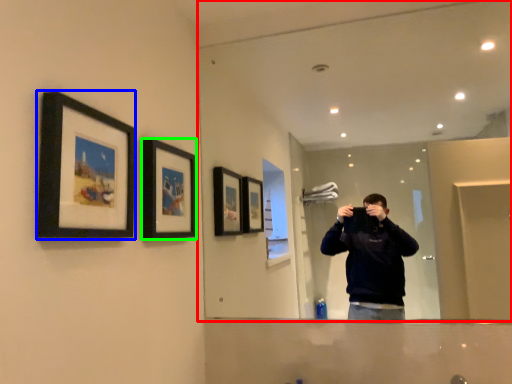
Question: Which object is the closest to the mirror (highlighted by a red box)? Choose among these: picture frame (highlighted by a blue box) or picture frame (highlighted by a green box).

Choices:
 (A) picture frame
 (B) picture frame

Answer: (B)